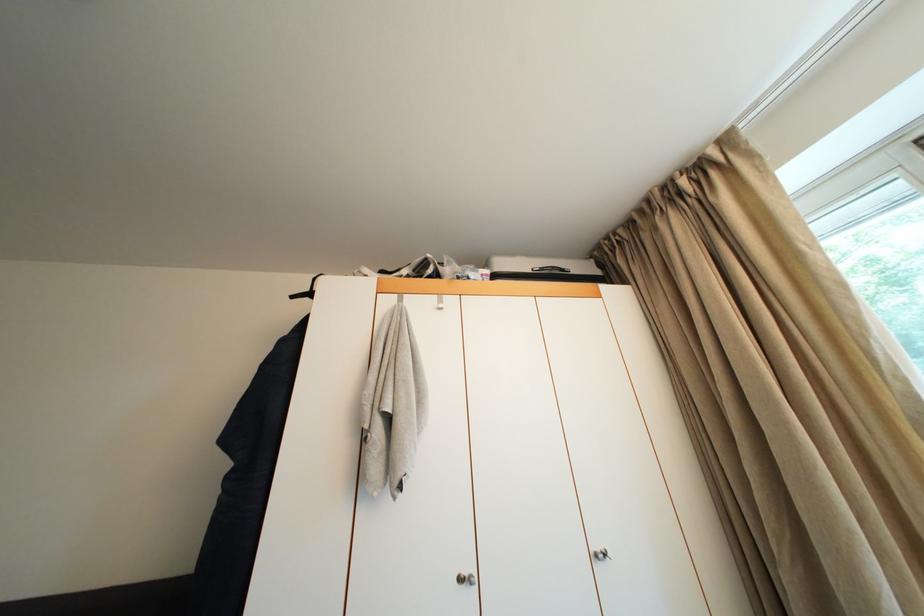
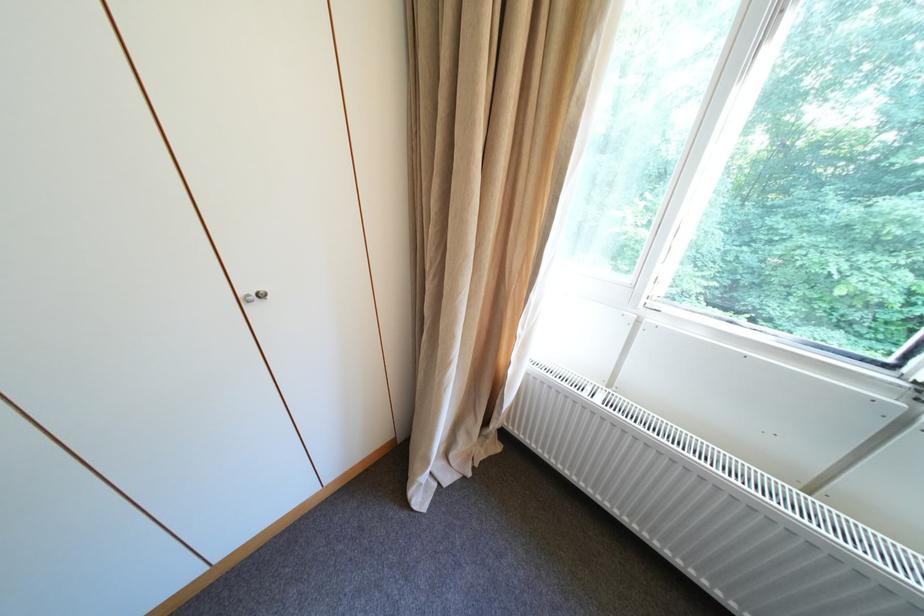
First-person continuous shooting, in which direction is the camera rotating?

The rotation direction of the camera is right-down.